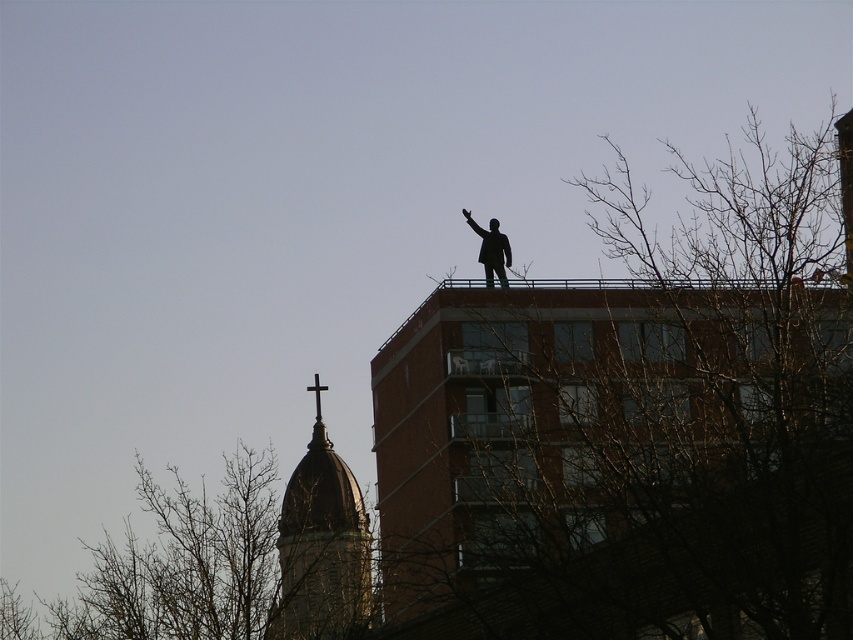
Looking at the dark brown stone tower at upper center and the black matte statue at upper center in the image, which one is positioned to the left?

The dark brown stone tower at upper center is to the left of the black matte statue at upper center.

You are standing in front of the tall reddish brown brick building with a figure on top. You notice two points marked in the image. The first point is at coordinates point (527, 534) and the second is at point (492, 244). Which point is closer to you?

Point (527, 534) is closer to the camera than point (492, 244).